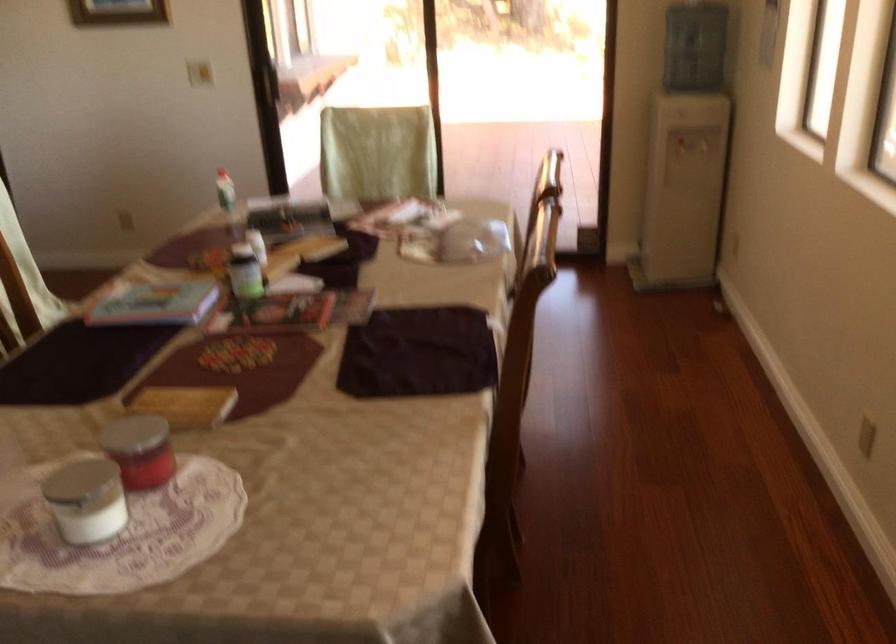
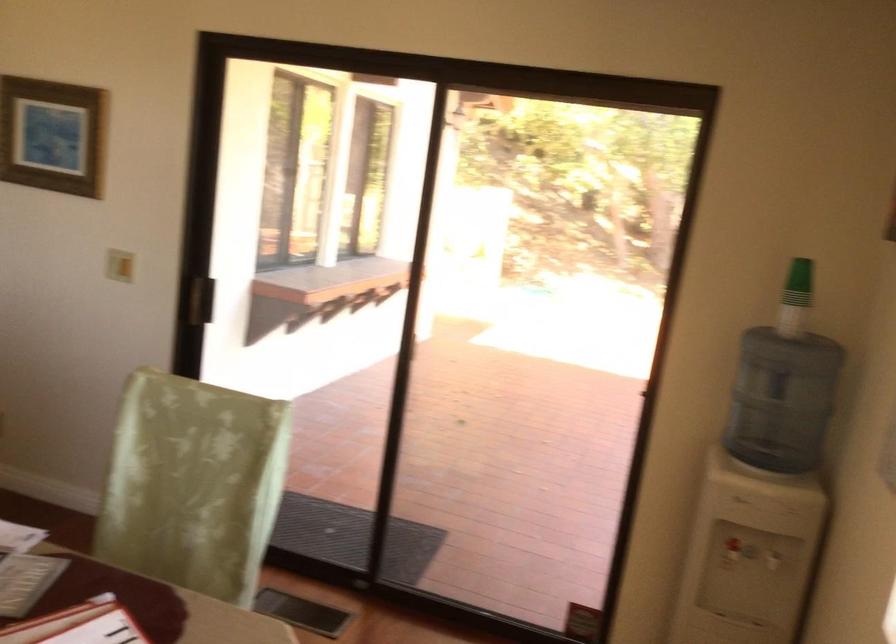
Where in the second image is the point corresponding to [681,138] from the first image?

(731, 553)